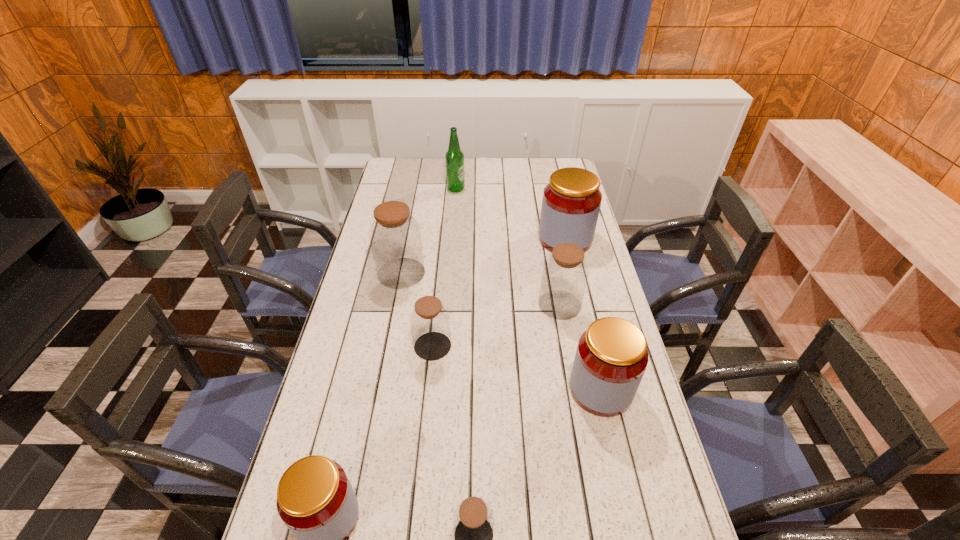
Locate an element on the screen. vacant area located 0.050m on the label of the farthest object is located at coordinates (476, 189).

Find the location of a particular element. This screenshot has height=540, width=960. vacant area situated 0.240m on the back of the farthest jar is located at coordinates (555, 192).

Locate an element on the screen. Image resolution: width=960 pixels, height=540 pixels. vacant space located 0.170m on the right of the biggest brown jar is located at coordinates (472, 273).

Identify the location of free region located 0.180m on the back of the rightmost brown jar. The image size is (960, 540). (551, 256).

At what (x,y) coordinates should I click in order to perform the action: click on free space located 0.060m on the back of the second nearest red jar. Please return your answer as a coordinate pair (x, y). Looking at the image, I should click on (591, 347).

Find the location of a particular element. The height and width of the screenshot is (540, 960). free location located 0.090m on the back of the fifth farthest object is located at coordinates (436, 310).

The image size is (960, 540). Find the location of `object present at the left edge`. object present at the left edge is located at coordinates (395, 236).

Locate an element on the screen. This screenshot has width=960, height=540. vacant region at the far edge is located at coordinates (482, 165).

Where is `free point at the left edge`? Image resolution: width=960 pixels, height=540 pixels. free point at the left edge is located at coordinates (386, 320).

Locate an element on the screen. The height and width of the screenshot is (540, 960). free space at the right edge of the desktop is located at coordinates (658, 455).